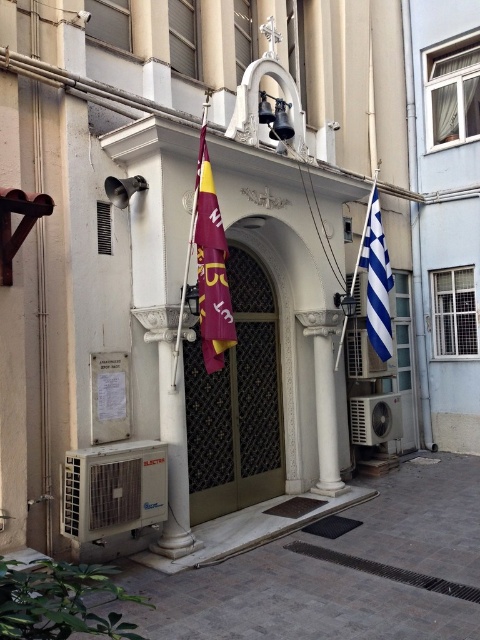
You are a visitor arriving at the entrance of this building and need to enter. The gold metallic door at center is the main entrance. However, you notice the blue and white striped flag at right. Is the door wide enough for you to pass through without touching the flag?

The gold metallic door at center has a larger size compared to the blue and white striped flag at right. Since the door is larger, it is likely wide enough for you to pass through without touching the flag.

You are a visitor approaching the entrance of the building. You need to locate the gold metallic door at center and the blue and white striped flag at right. Based on their positions, which object is closer to your left side as you face the entrance?

The gold metallic door at center is to the left of the blue and white striped flag at right, so as you face the entrance, the gold metallic door at center will be on your left side and the blue and white striped flag at right will be on your right side.

In the scene shown: You are standing at the entrance of a building with a Greek flag displayed on the right side. There is a point marked at coordinates (237, 403). What object is located at this point?

The gold metallic door at center is located at point (237, 403).